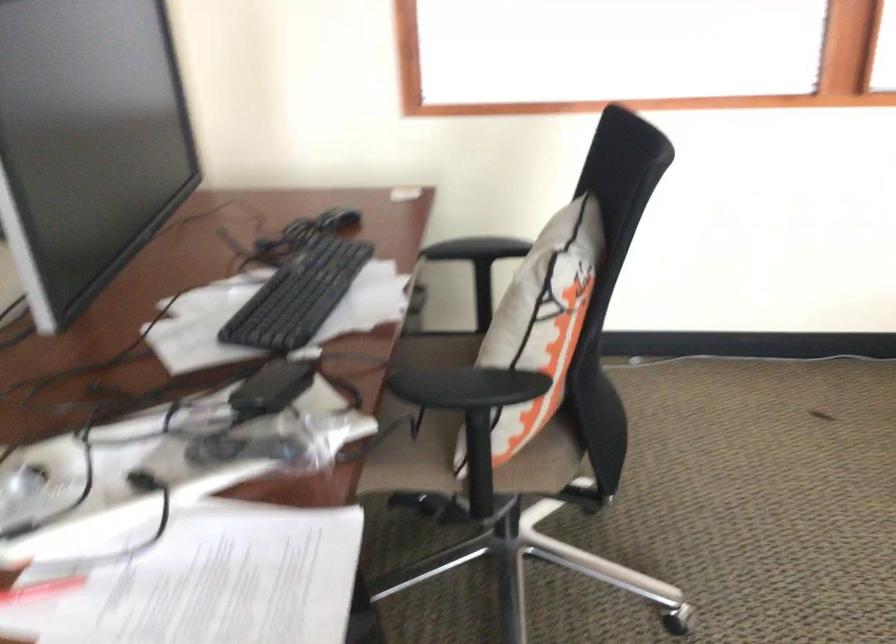
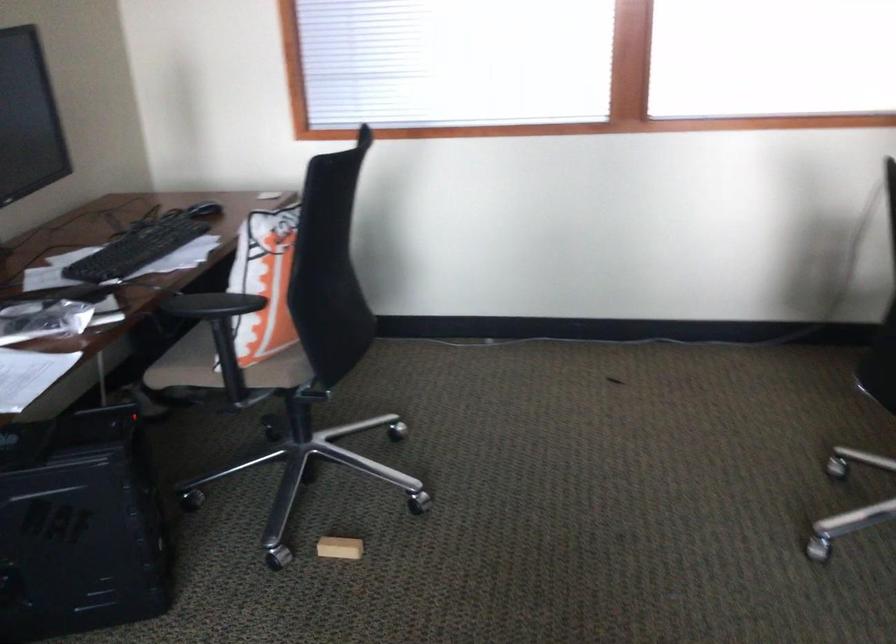
Find the pixel in the second image that matches the point at 478,478 in the first image.

(228, 370)